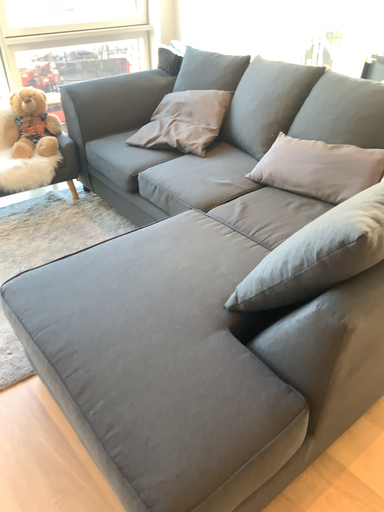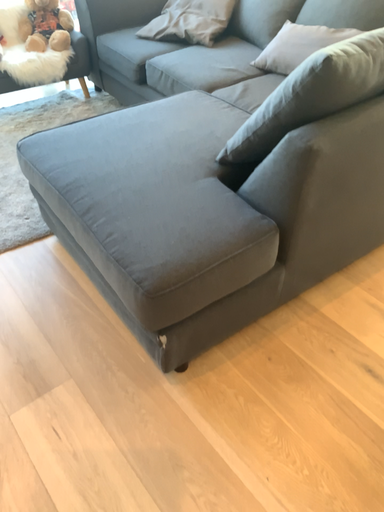
Question: Which way did the camera rotate in the video?

Choices:
 (A) rotated upward
 (B) rotated downward

Answer: (B)